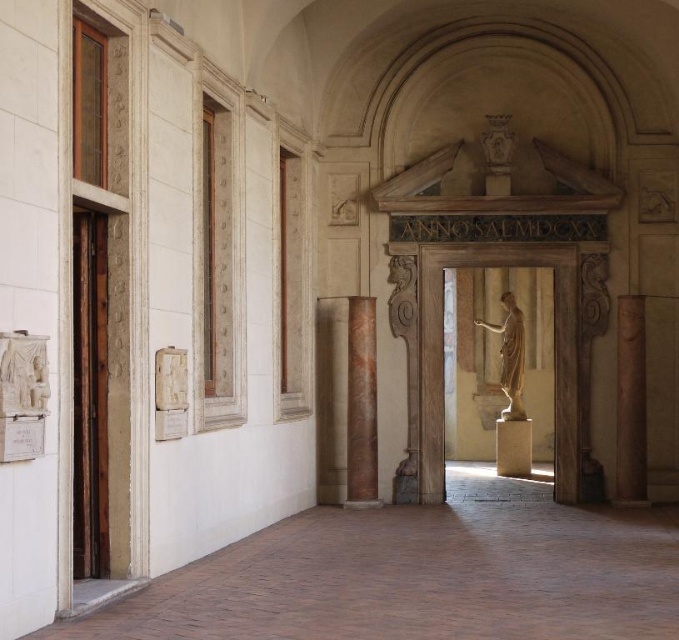
You are an art conservator examining the interior of a classical building. You notice the brown polished stone column at right and the white marble statue at left. Based on their positions, which object is closer to the floor?

The brown polished stone column at right is closer to the floor because it is positioned below the white marble statue at left.

You are standing in the gallery and notice two points marked on the wall. The first point is at coordinates point (638, 416) and the second at point (369, 301). Which of these points is nearer to your current position?

Point (638, 416) is closer to the camera than point (369, 301), so the first point is nearer to your current position.